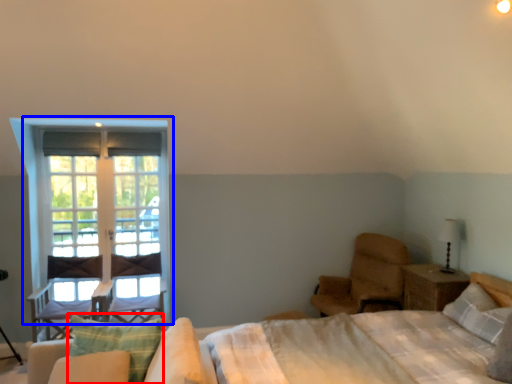
Question: Among these objects, which one is nearest to the camera, pillow (highlighted by a red box) or window (highlighted by a blue box)?

Choices:
 (A) pillow
 (B) window

Answer: (A)